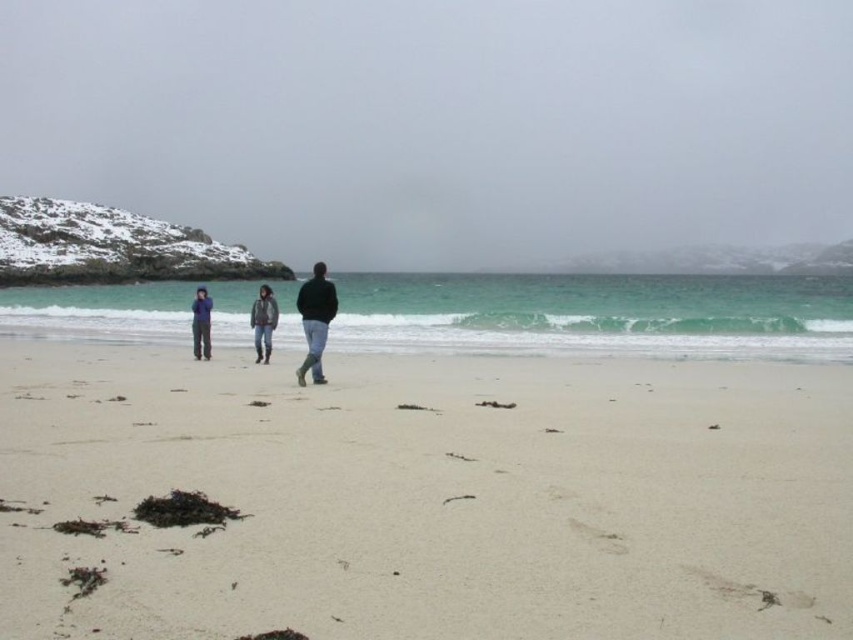
Question: Which object is closer to the camera taking this photo?

Choices:
 (A) denim jacket at center
 (B) smooth sand at center

Answer: (B)

Question: Among these points, which one is farthest from the camera?

Choices:
 (A) (202, 310)
 (B) (262, 317)

Answer: (A)

Question: Among these points, which one is nearest to the camera?

Choices:
 (A) (318, 378)
 (B) (260, 548)
 (C) (833, 177)
 (D) (273, 298)

Answer: (B)

Question: Can you confirm if dark green jacket at center is positioned below blue fleece jacket at center?

Choices:
 (A) yes
 (B) no

Answer: (B)

Question: Considering the relative positions of white sand at center and blue fleece jacket at center in the image provided, where is white sand at center located with respect to blue fleece jacket at center?

Choices:
 (A) right
 (B) left

Answer: (A)

Question: Is dark green jacket at center positioned behind denim jacket at center?

Choices:
 (A) no
 (B) yes

Answer: (A)